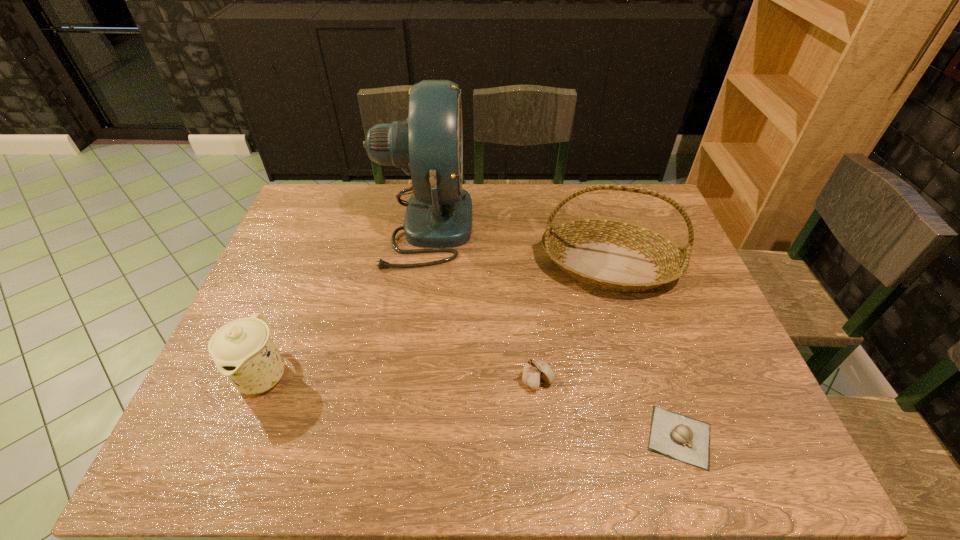
Where is `free space at the far edge of the desktop`? The image size is (960, 540). free space at the far edge of the desktop is located at coordinates (352, 207).

This screenshot has height=540, width=960. In the image, there is a desktop. In order to click on blank space at the near edge in this screenshot , I will do `click(542, 437)`.

You are a GUI agent. You are given a task and a screenshot of the screen. Output one action in this format:
    pyautogui.click(x=<x>, y=<y>)
    Task: Click on the vacant space at the left edge
    The image size is (960, 540).
    Given the screenshot: What is the action you would take?
    pyautogui.click(x=299, y=233)

This screenshot has width=960, height=540. In the image, there is a desktop. Identify the location of free region at the right edge. (686, 374).

Where is `vacant space at the far left corner`? The image size is (960, 540). vacant space at the far left corner is located at coordinates (347, 202).

This screenshot has height=540, width=960. I want to click on vacant space at the far right corner of the desktop, so click(641, 187).

Find the location of a particular element. vacant space at the near right corner of the desktop is located at coordinates (750, 439).

This screenshot has height=540, width=960. I want to click on empty location between the nearer garlic and the third tallest object, so click(471, 406).

The height and width of the screenshot is (540, 960). I want to click on vacant space that's between the third object from right to left and the shortest object, so click(x=609, y=409).

This screenshot has height=540, width=960. Find the location of `free spot between the basket and the nearer garlic`. free spot between the basket and the nearer garlic is located at coordinates (644, 351).